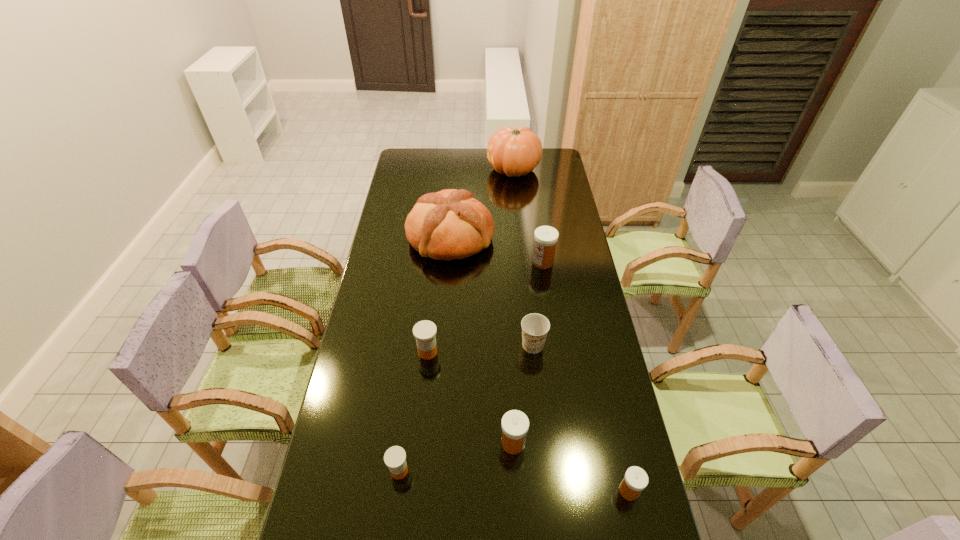
Find the location of a particular element. free space at the far right corner of the desktop is located at coordinates (553, 153).

Locate an element on the screen. vacant area between the biggest white medicine and the Dixie cup is located at coordinates (538, 303).

Where is `vacant area between the nearer orange medicine and the rightmost medicine`? This screenshot has height=540, width=960. vacant area between the nearer orange medicine and the rightmost medicine is located at coordinates (514, 481).

Identify the location of free space between the farther orange medicine and the orange Dixie cup. pyautogui.click(x=480, y=348).

Locate an element on the screen. This screenshot has width=960, height=540. free point between the orange Dixie cup and the third nearest object is located at coordinates (523, 394).

Image resolution: width=960 pixels, height=540 pixels. Identify the location of free area in between the bread and the third nearest medicine. (482, 340).

Identify the location of vacant region between the rightmost white medicine and the bread. The height and width of the screenshot is (540, 960). (540, 364).

Where is `free space between the second biggest white medicine and the rightmost object`? free space between the second biggest white medicine and the rightmost object is located at coordinates (571, 467).

Where is `empty location between the nearest white medicine and the Dixie cup`? The image size is (960, 540). empty location between the nearest white medicine and the Dixie cup is located at coordinates (581, 418).

Where is `object that is the seventh closest to the nearer orange medicine`? This screenshot has width=960, height=540. object that is the seventh closest to the nearer orange medicine is located at coordinates (515, 152).